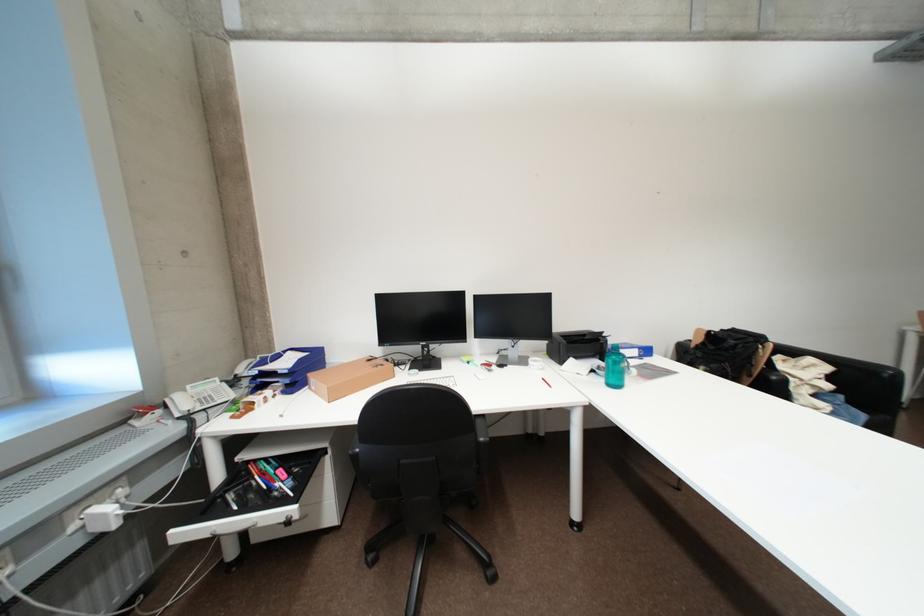
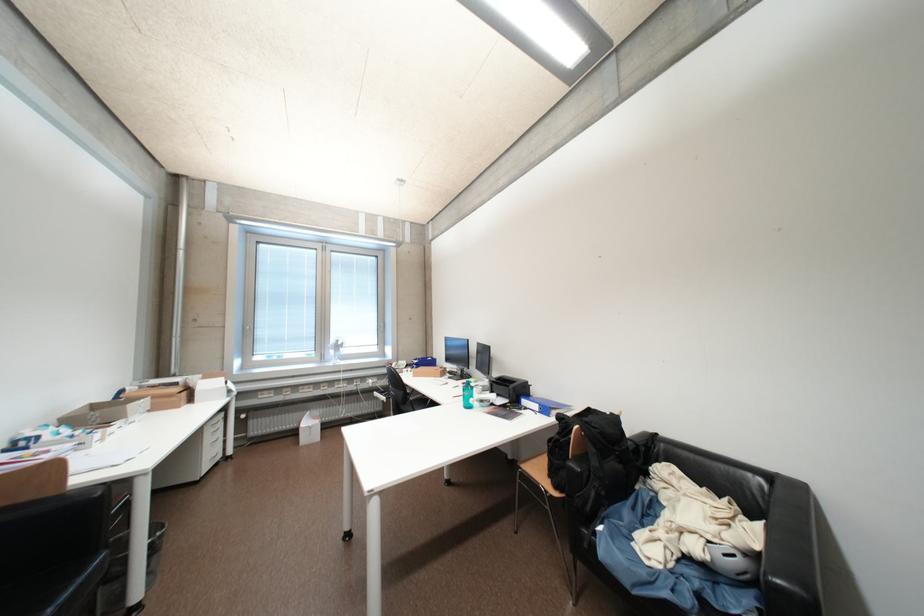
The point at [660,358] is marked in the first image. Where is the corresponding point in the second image?

(555, 418)